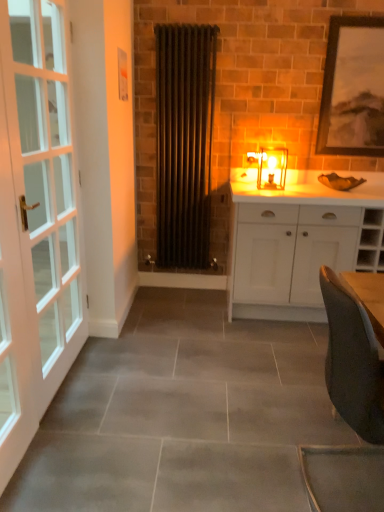
The width and height of the screenshot is (384, 512). I want to click on black matte picture frame at upper right, so click(x=353, y=88).

Considering the relative sizes of matte black radiator at center and black matte picture frame at upper right in the image provided, is matte black radiator at center smaller than black matte picture frame at upper right?

Actually, matte black radiator at center might be larger than black matte picture frame at upper right.

Looking at this image, is the depth of matte black radiator at center greater than that of black matte picture frame at upper right?

That is False.

From a real-world perspective, is matte black radiator at center positioned over black matte picture frame at upper right based on gravity?

No, from a real-world perspective, matte black radiator at center is not on top of black matte picture frame at upper right.

Is the surface of matte black radiator at center in direct contact with black matte picture frame at upper right?

matte black radiator at center and black matte picture frame at upper right are not in contact.

Is matte black radiator at center taller than white glass door at left?

In fact, matte black radiator at center may be shorter than white glass door at left.

Based on the photo, from a real-world perspective, which object rests below the other?

From a 3D spatial view, white glass door at left is below.

Between matte black radiator at center and white glass door at left, which one has larger width?

white glass door at left.

Does matte black radiator at center have a larger size compared to white glass door at left?

No, matte black radiator at center is not bigger than white glass door at left.

In the image, is matte glass candlestick at center on the left side or the right side of black matte picture frame at upper right?

Clearly, matte glass candlestick at center is on the left of black matte picture frame at upper right in the image.

At what (x,y) coordinates should I click in order to perform the action: click on light fixture that appears below the black matte picture frame at upper right (from the image's perspective). Please return your answer as a coordinate pair (x, y). Looking at the image, I should click on (270, 167).

Are matte glass candlestick at center and black matte picture frame at upper right making contact?

No.

Looking at this image, is matte glass candlestick at center looking in the opposite direction of black matte picture frame at upper right?

No.

Looking at this image, what's the angular difference between matte glass candlestick at center and matte black radiator at center's facing directions?

0.000177 degrees separate the facing orientations of matte glass candlestick at center and matte black radiator at center.

From the image's perspective, is matte glass candlestick at center positioned above or below matte black radiator at center?

matte glass candlestick at center is below matte black radiator at center.

Is matte glass candlestick at center in contact with matte black radiator at center?

No, matte glass candlestick at center is not making contact with matte black radiator at center.

Does point (269, 187) appear closer or farther from the camera than point (207, 128)?

Point (269, 187) is positioned closer to the camera compared to point (207, 128).

Considering the sizes of objects white matte cabinet at center and black matte picture frame at upper right in the image provided, who is shorter, white matte cabinet at center or black matte picture frame at upper right?

white matte cabinet at center is shorter.

Is white matte cabinet at center oriented towards black matte picture frame at upper right?

No, white matte cabinet at center is not turned towards black matte picture frame at upper right.

Considering the points (255, 245) and (336, 50), which point is behind, point (255, 245) or point (336, 50)?

The point (336, 50) is more distant.

Which of these two, white matte cabinet at center or black matte picture frame at upper right, is bigger?

With larger size is white matte cabinet at center.

Would you say matte black radiator at center is inside or outside white matte cabinet at center?

matte black radiator at center lies outside white matte cabinet at center.

Consider the image. Considering the relative positions of matte black radiator at center and white matte cabinet at center in the image provided, is matte black radiator at center behind white matte cabinet at center?

Yes, the depth of matte black radiator at center is greater than that of white matte cabinet at center.

Can you confirm if matte black radiator at center is bigger than white matte cabinet at center?

No, matte black radiator at center is not bigger than white matte cabinet at center.

Is white matte cabinet at center far away from matte glass candlestick at center?

Actually, white matte cabinet at center and matte glass candlestick at center are a little close together.

Is white matte cabinet at center in front of or behind matte glass candlestick at center in the image?

white matte cabinet at center is in front of matte glass candlestick at center.

Is white matte cabinet at center taller or shorter than matte glass candlestick at center?

white matte cabinet at center is taller than matte glass candlestick at center.

Which of these two, white matte cabinet at center or matte glass candlestick at center, is bigger?

With larger size is white matte cabinet at center.

The image size is (384, 512). Identify the location of radiator located underneath the black matte picture frame at upper right (from a real-world perspective). [184, 142].

Locate an element on the screen. Image resolution: width=384 pixels, height=512 pixels. radiator lying on the right of white glass door at left is located at coordinates point(184,142).

In the scene shown: Based on their spatial positions, is white matte cabinet at center or white glass door at left further from matte glass candlestick at center?

Among the two, white glass door at left is located further to matte glass candlestick at center.

From the image, which object appears to be farther from white glass door at left, matte black radiator at center or white matte cabinet at center?

white matte cabinet at center.

Looking at the image, which one is located closer to matte glass candlestick at center, black matte picture frame at upper right or matte black radiator at center?

black matte picture frame at upper right lies closer to matte glass candlestick at center than the other object.

Considering their positions, is black matte picture frame at upper right positioned further to white glass door at left than matte glass candlestick at center?

black matte picture frame at upper right is positioned further to the anchor white glass door at left.

Based on their spatial positions, is black matte picture frame at upper right or matte glass candlestick at center further from matte black radiator at center?

black matte picture frame at upper right is further to matte black radiator at center.

When comparing their distances from black matte picture frame at upper right, does matte glass candlestick at center or matte black radiator at center seem further?

matte black radiator at center.

Looking at the image, which one is located further to white glass door at left, white matte cabinet at center or black matte picture frame at upper right?

Among the two, black matte picture frame at upper right is located further to white glass door at left.

When comparing their distances from matte glass candlestick at center, does matte black radiator at center or white matte cabinet at center seem further?

matte black radiator at center lies further to matte glass candlestick at center than the other object.

You are a GUI agent. You are given a task and a screenshot of the screen. Output one action in this format:
    pyautogui.click(x=<x>, y=<y>)
    Task: Click on the light fixture between black matte picture frame at upper right and white matte cabinet at center vertically
    
    Given the screenshot: What is the action you would take?
    pyautogui.click(x=270, y=167)

Find the location of a particular element. This screenshot has width=384, height=512. light fixture located between matte black radiator at center and black matte picture frame at upper right in the left-right direction is located at coordinates [x=270, y=167].

Locate an element on the screen. cabinetry situated between matte black radiator at center and black matte picture frame at upper right from left to right is located at coordinates (291, 242).

This screenshot has width=384, height=512. Find the location of `cabinetry positioned between white glass door at left and black matte picture frame at upper right from near to far`. cabinetry positioned between white glass door at left and black matte picture frame at upper right from near to far is located at coordinates (291, 242).